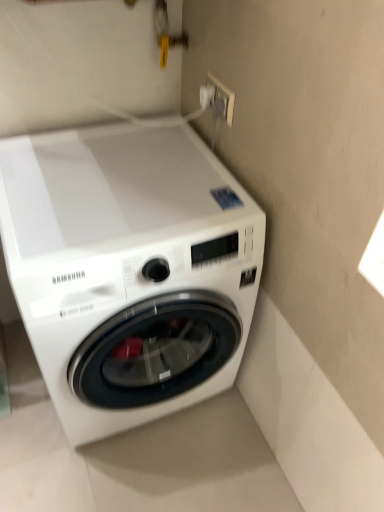
Question: From the image's perspective, relative to white glossy washing machine at lower left, is white plastic socket at upper right above or below?

Choices:
 (A) below
 (B) above

Answer: (B)

Question: Considering the positions of white plastic socket at upper right and white glossy washing machine at lower left in the image, is white plastic socket at upper right taller or shorter than white glossy washing machine at lower left?

Choices:
 (A) tall
 (B) short

Answer: (B)

Question: Considering the positions of white plastic socket at upper right and white glossy washing machine at lower left in the image, is white plastic socket at upper right wider or thinner than white glossy washing machine at lower left?

Choices:
 (A) thin
 (B) wide

Answer: (A)

Question: Is white glossy washing machine at lower left inside the boundaries of white plastic socket at upper right, or outside?

Choices:
 (A) outside
 (B) inside

Answer: (A)

Question: In the image, is white glossy washing machine at lower left positioned in front of or behind white plastic socket at upper right?

Choices:
 (A) front
 (B) behind

Answer: (A)

Question: Considering the positions of white glossy washing machine at lower left and white plastic socket at upper right in the image, is white glossy washing machine at lower left bigger or smaller than white plastic socket at upper right?

Choices:
 (A) small
 (B) big

Answer: (B)

Question: From a real-world perspective, relative to white plastic socket at upper right, is white glossy washing machine at lower left vertically above or below?

Choices:
 (A) above
 (B) below

Answer: (B)